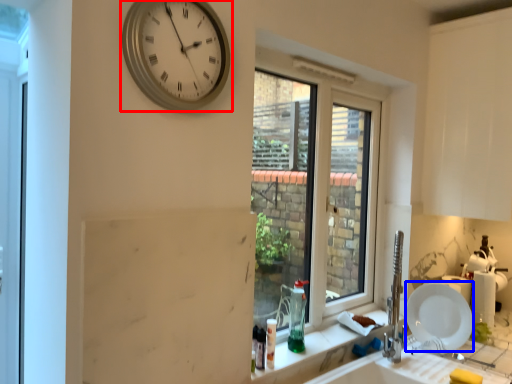
Question: Which point is closer to the camera, wall clock (highlighted by a red box) or plate (highlighted by a blue box)?

Choices:
 (A) wall clock
 (B) plate

Answer: (A)